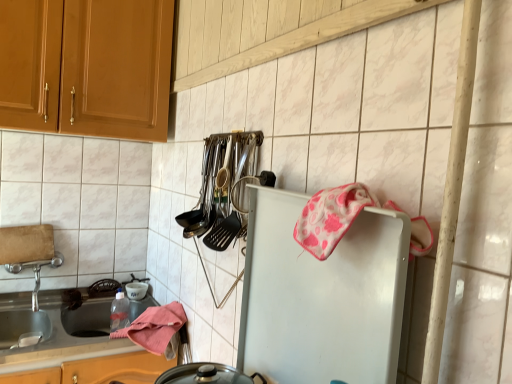
What do you see at coordinates (223, 188) in the screenshot? The height and width of the screenshot is (384, 512). I see `polished stainless steel utensils at center` at bounding box center [223, 188].

Identify the location of pink fabric towel at lower left, which ranks as the first material in back-to-front order. This screenshot has width=512, height=384. (155, 327).

I want to click on white matte refrigerator at center-right, so click(x=322, y=296).

Where is `polished stainless steel utensils at center`? This screenshot has width=512, height=384. polished stainless steel utensils at center is located at coordinates (223, 188).

In the scene shown: Which object is positioned more to the left, polished stainless steel utensils at center or pink fabric towel at lower left, the first material when ordered from left to right?

pink fabric towel at lower left, the first material when ordered from left to right, is more to the left.

Can you confirm if polished stainless steel utensils at center is wider than pink fabric towel at lower left, placed as the second material when sorted from top to bottom?

No, polished stainless steel utensils at center is not wider than pink fabric towel at lower left, placed as the second material when sorted from top to bottom.

Can you tell me how much polished stainless steel utensils at center and pink fabric towel at lower left, which is the second material in front-to-back order, differ in facing direction?

Result: They differ by 0.0581 degrees in their facing directions.

Is polished stainless steel utensils at center aimed at pink fabric towel at lower left, which appears as the second material when viewed from the right?

No, polished stainless steel utensils at center is not facing towards pink fabric towel at lower left, which appears as the second material when viewed from the right.

Based on the photo, how much distance is there between white matte refrigerator at center-right and white glossy countertop at lower left?

A distance of 36.43 inches exists between white matte refrigerator at center-right and white glossy countertop at lower left.

What's the angular difference between white matte refrigerator at center-right and white glossy countertop at lower left's facing directions?

The angular difference between white matte refrigerator at center-right and white glossy countertop at lower left is 90.9 degrees.

Are white matte refrigerator at center-right and white glossy countertop at lower left far apart?

white matte refrigerator at center-right is actually quite close to white glossy countertop at lower left.

This screenshot has height=384, width=512. What are the coordinates of `countertop on the left of white matte refrigerator at center-right` in the screenshot? It's located at (55, 327).

Measure the distance between polished stainless steel utensils at center and white matte refrigerator at center-right.

They are 9.58 inches apart.

Is polished stainless steel utensils at center not within white matte refrigerator at center-right?

polished stainless steel utensils at center is positioned outside white matte refrigerator at center-right.

From the image's perspective, between polished stainless steel utensils at center and white matte refrigerator at center-right, who is located below?

white matte refrigerator at center-right, from the image's perspective.

What's the angular difference between polished stainless steel utensils at center and white matte refrigerator at center-right's facing directions?

3.26 degrees.

Could you tell me if white matte refrigerator at center-right is turned towards polished stainless steel utensils at center?

No, white matte refrigerator at center-right is not aimed at polished stainless steel utensils at center.

Considering the relative sizes of white matte refrigerator at center-right and polished stainless steel utensils at center in the image provided, is white matte refrigerator at center-right thinner than polished stainless steel utensils at center?

Yes, white matte refrigerator at center-right is thinner than polished stainless steel utensils at center.

Which is closer, [365,274] or [205,216]?

Point [365,274] is closer to the camera than point [205,216].

From a real-world perspective, does white matte refrigerator at center-right sit lower than polished stainless steel utensils at center?

Yes.

Does white matte refrigerator at center-right turn towards pink fabric towel at lower left, placed as the second material when sorted from top to bottom?

No, white matte refrigerator at center-right is not turned towards pink fabric towel at lower left, placed as the second material when sorted from top to bottom.

Considering the relative sizes of white matte refrigerator at center-right and pink fabric towel at lower left, the first material when ordered from left to right, in the image provided, is white matte refrigerator at center-right bigger than pink fabric towel at lower left, the first material when ordered from left to right,?

Actually, white matte refrigerator at center-right might be smaller than pink fabric towel at lower left, the first material when ordered from left to right.

Is white matte refrigerator at center-right further to the viewer compared to pink fabric towel at lower left, which is the second material in front-to-back order?

No, it is not.

Where is `material on the left of white matte refrigerator at center-right`? Image resolution: width=512 pixels, height=384 pixels. material on the left of white matte refrigerator at center-right is located at coordinates (155, 327).

From a real-world perspective, is white glossy countertop at lower left on white matte refrigerator at center-right?

Actually, white glossy countertop at lower left is physically below white matte refrigerator at center-right in the real world.

Are white glossy countertop at lower left and white matte refrigerator at center-right far apart?

white glossy countertop at lower left is actually quite close to white matte refrigerator at center-right.

Can you tell me how much white glossy countertop at lower left and white matte refrigerator at center-right differ in facing direction?

90.9 degrees separate the facing orientations of white glossy countertop at lower left and white matte refrigerator at center-right.

Where is `countertop on the left of white matte refrigerator at center-right`? The image size is (512, 384). countertop on the left of white matte refrigerator at center-right is located at coordinates (55, 327).

Are white glossy countertop at lower left and pink fabric towel at upper right, which is the first material in top-to-bottom order, far apart?

white glossy countertop at lower left is far away from pink fabric towel at upper right, which is the first material in top-to-bottom order.

Considering the sizes of white glossy countertop at lower left and pink fabric towel at upper right, acting as the 1th material starting from the right, in the image, is white glossy countertop at lower left bigger or smaller than pink fabric towel at upper right, acting as the 1th material starting from the right,?

Considering their sizes, white glossy countertop at lower left takes up more space than pink fabric towel at upper right, acting as the 1th material starting from the right.

From a real-world perspective, which is physically above, white glossy countertop at lower left or pink fabric towel at upper right, acting as the 1th material starting from the right?

pink fabric towel at upper right, acting as the 1th material starting from the right, from a real-world perspective.

Considering the relative sizes of white glossy countertop at lower left and pink fabric towel at upper right, the second material in the bottom-to-top sequence, in the image provided, is white glossy countertop at lower left taller than pink fabric towel at upper right, the second material in the bottom-to-top sequence,?

Correct, white glossy countertop at lower left is much taller as pink fabric towel at upper right, the second material in the bottom-to-top sequence.

Image resolution: width=512 pixels, height=384 pixels. What are the coordinates of `silverware above the pink fabric towel at lower left, placed as the second material when sorted from top to bottom (from the image's perspective)` in the screenshot? It's located at click(223, 188).

The width and height of the screenshot is (512, 384). Identify the location of refrigerator located above the white glossy countertop at lower left (from a real-world perspective). (322, 296).

From the image, which object appears to be farther from pink fabric towel at upper right, acting as the 1th material starting from the right, pink fabric towel at lower left, the first material when ordered from left to right, or polished stainless steel utensils at center?

The object further to pink fabric towel at upper right, acting as the 1th material starting from the right, is pink fabric towel at lower left, the first material when ordered from left to right.

When comparing their distances from white glossy countertop at lower left, does polished stainless steel utensils at center or pink fabric towel at lower left, which appears as the second material when viewed from the right, seem closer?

Based on the image, pink fabric towel at lower left, which appears as the second material when viewed from the right, appears to be nearer to white glossy countertop at lower left.

Based on their spatial positions, is white matte refrigerator at center-right or pink fabric towel at upper right, the second material in the bottom-to-top sequence, further from pink fabric towel at lower left, which ranks as the first material in back-to-front order?

Among the two, pink fabric towel at upper right, the second material in the bottom-to-top sequence, is located further to pink fabric towel at lower left, which ranks as the first material in back-to-front order.

Estimate the real-world distances between objects in this image. Which object is closer to white matte refrigerator at center-right, pink fabric towel at lower left, which is the second material in front-to-back order, or polished stainless steel utensils at center?

polished stainless steel utensils at center is closer to white matte refrigerator at center-right.

Considering their positions, is pink fabric towel at lower left, which ranks as the first material in back-to-front order, positioned further to white glossy countertop at lower left than polished stainless steel utensils at center?

The object further to white glossy countertop at lower left is polished stainless steel utensils at center.

Looking at the image, which one is located further to white glossy countertop at lower left, white matte refrigerator at center-right or polished stainless steel utensils at center?

The object further to white glossy countertop at lower left is white matte refrigerator at center-right.

In the scene shown: Looking at the image, which one is located closer to white glossy countertop at lower left, white matte refrigerator at center-right or pink fabric towel at lower left, which ranks as the first material in back-to-front order?

Based on the image, pink fabric towel at lower left, which ranks as the first material in back-to-front order, appears to be nearer to white glossy countertop at lower left.

Looking at the image, which one is located closer to pink fabric towel at upper right, the second material when ordered from back to front, white glossy countertop at lower left or polished stainless steel utensils at center?

The object closer to pink fabric towel at upper right, the second material when ordered from back to front, is polished stainless steel utensils at center.

Locate an element on the screen. The height and width of the screenshot is (384, 512). material between white matte refrigerator at center-right and polished stainless steel utensils at center in the front-back direction is located at coordinates [x=330, y=217].

Where is `material between white glossy countertop at lower left and pink fabric towel at upper right, which appears as the 2th material when viewed from the left, from left to right`? Image resolution: width=512 pixels, height=384 pixels. material between white glossy countertop at lower left and pink fabric towel at upper right, which appears as the 2th material when viewed from the left, from left to right is located at coordinates (155, 327).

The image size is (512, 384). What are the coordinates of `silverware located between white glossy countertop at lower left and pink fabric towel at upper right, acting as the 1th material starting from the right, in the left-right direction` in the screenshot? It's located at (223, 188).

Image resolution: width=512 pixels, height=384 pixels. I want to click on silverware between pink fabric towel at upper right, the second material in the bottom-to-top sequence, and pink fabric towel at lower left, which ranks as the first material in back-to-front order, in the front-back direction, so click(223, 188).